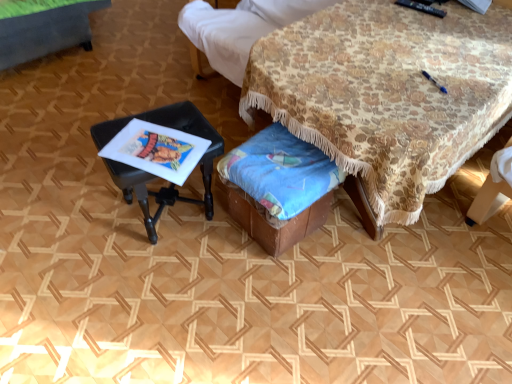
The width and height of the screenshot is (512, 384). I want to click on vacant area that is in front of blue fabric at lower center, so click(x=278, y=296).